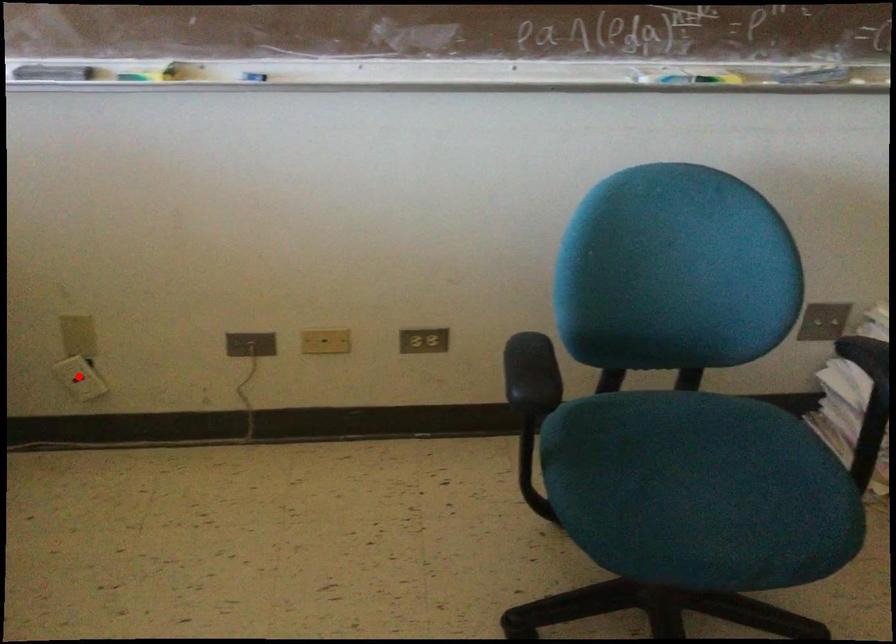
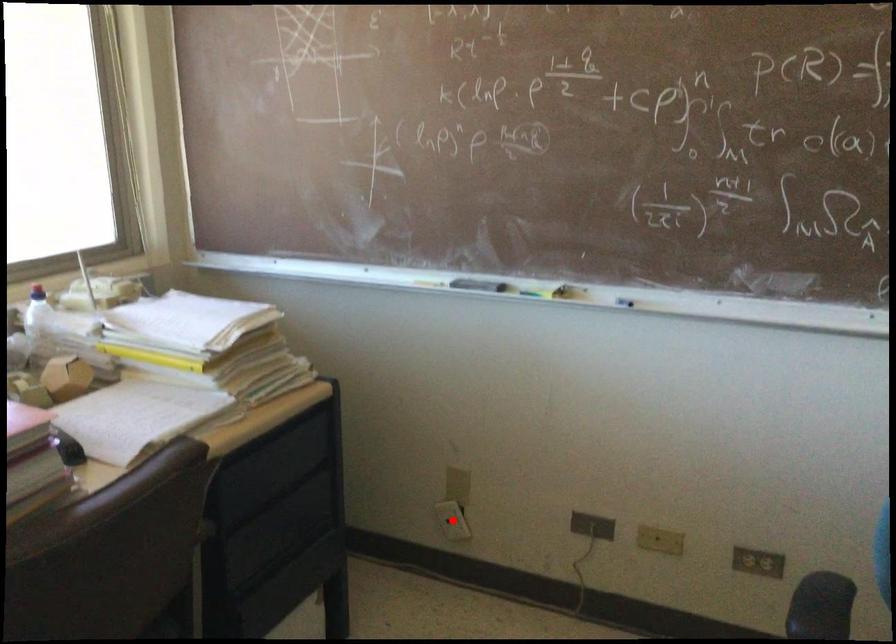
I am providing you with two images of the same scene from different viewpoints. A red point is marked on the first image and another point is marked on the second image. Do the highlighted points in image1 and image2 indicate the same real-world spot?

Yes